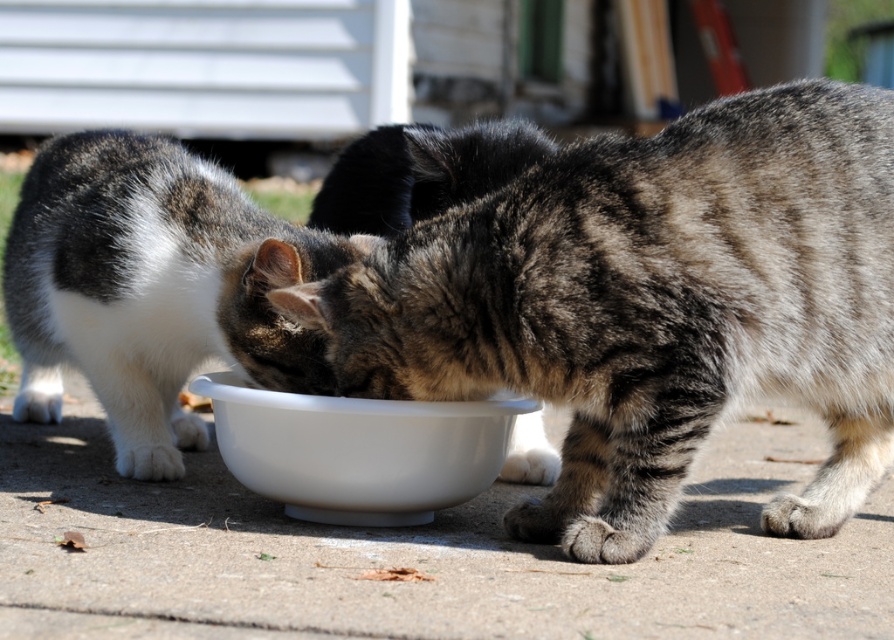
You are standing in front of the scene with three cats around a white bowl. You want to place a treat between the two points, point (753, 289) and point (69, 308). Which point is closer to you where you should place the treat first?

Answer: Point (753, 289) is closer to the viewer than point (69, 308), so you should place the treat at point (753, 289) first.

You are a photographer trying to capture a group photo of the tabby fur cat at center and the tabby fur cat at left. Based on their positions, which cat would you need to position closer to the camera to ensure both are fully visible in the frame?

The tabby fur cat at left should be positioned closer to the camera because the tabby fur cat at center might be wider and could block part of the tabby fur cat at left if they are both at the same distance.